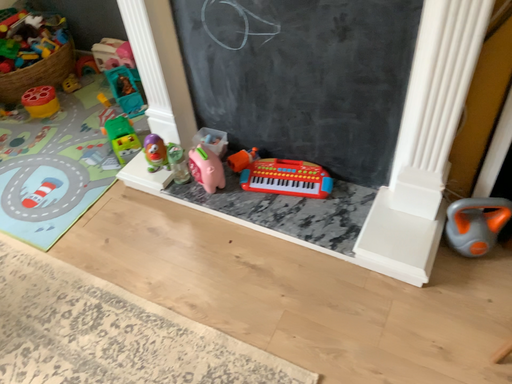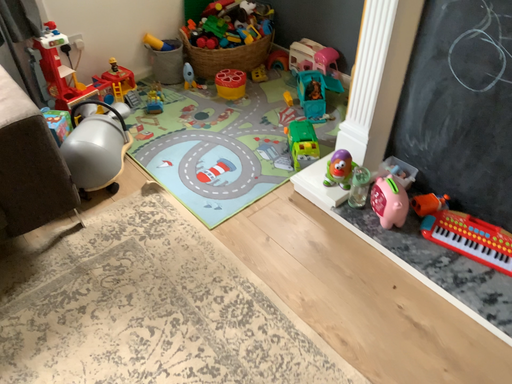
Question: Which way did the camera rotate in the video?

Choices:
 (A) rotated left
 (B) rotated right

Answer: (A)